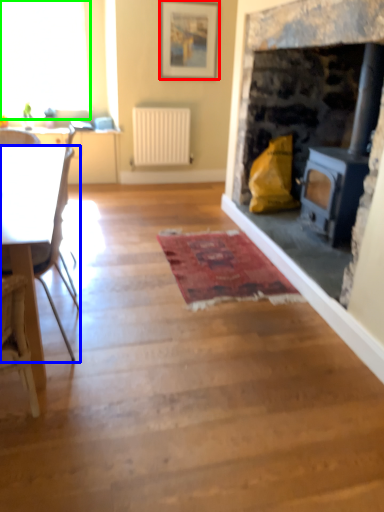
Question: Which object is positioned farthest from picture frame (highlighted by a red box)? Select from chair (highlighted by a blue box) and window (highlighted by a green box).

Choices:
 (A) chair
 (B) window

Answer: (A)